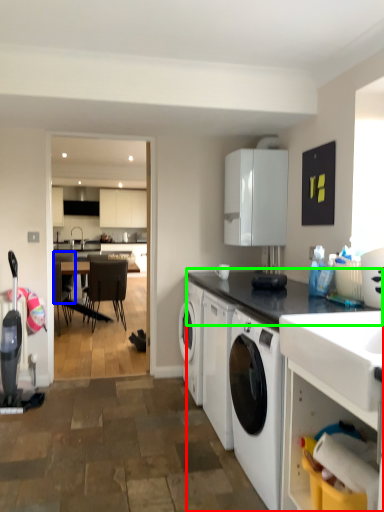
Question: Estimate the real-world distances between objects in this image. Which object is farther from countertop (highlighted by a red box), chair (highlighted by a blue box) or countertop (highlighted by a green box)?

Choices:
 (A) chair
 (B) countertop

Answer: (A)